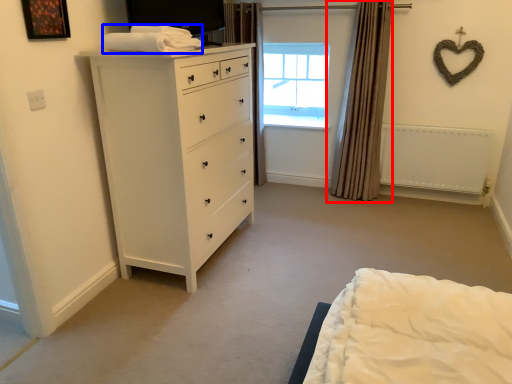
Question: Which object is further to the camera taking this photo, curtain (highlighted by a red box) or blanket (highlighted by a blue box)?

Choices:
 (A) curtain
 (B) blanket

Answer: (A)